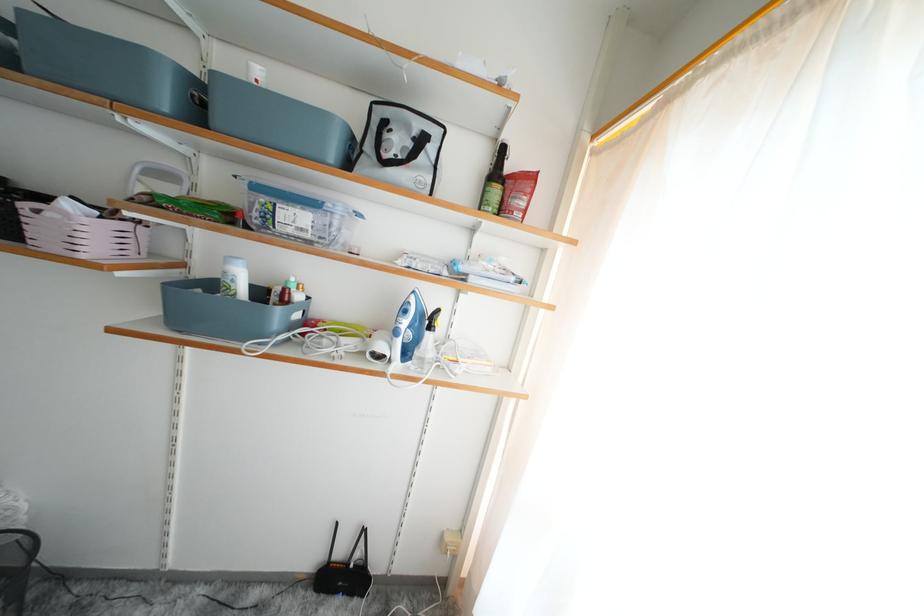
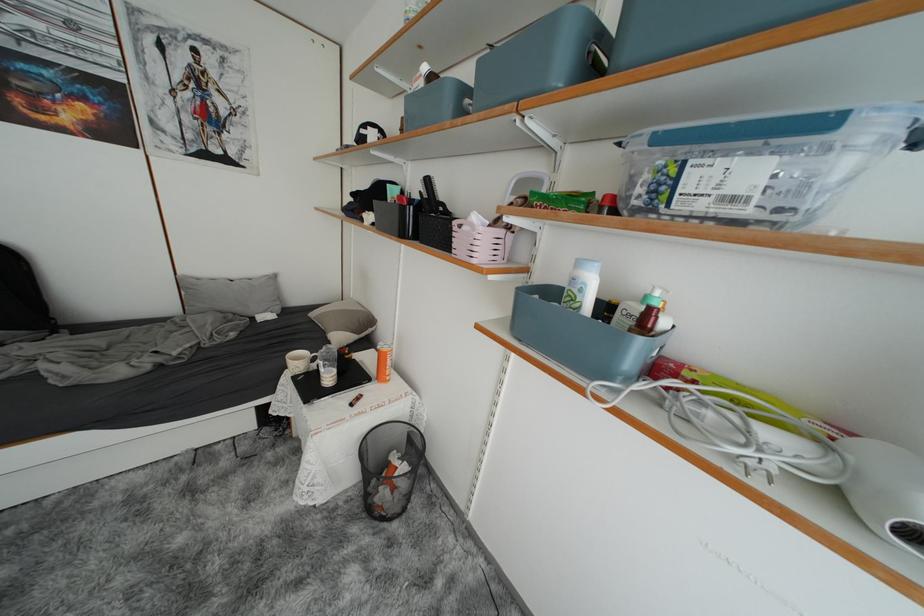
Question: The camera is either moving clockwise (left) or counter-clockwise (right) around the object. The first image is from the beginning of the video and the second image is from the end. Is the camera moving left or right when shooting the video?

Choices:
 (A) Left
 (B) Right

Answer: (B)